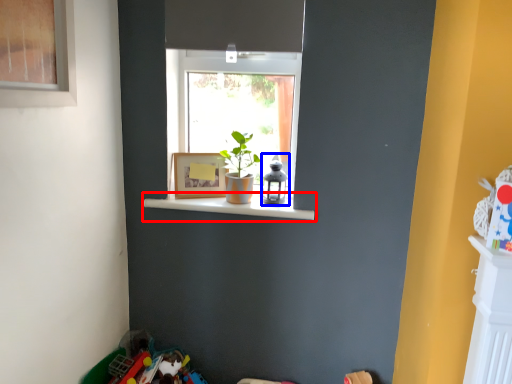
Question: Which point is further to the camera, window sill (highlighted by a red box) or toy (highlighted by a blue box)?

Choices:
 (A) window sill
 (B) toy

Answer: (B)